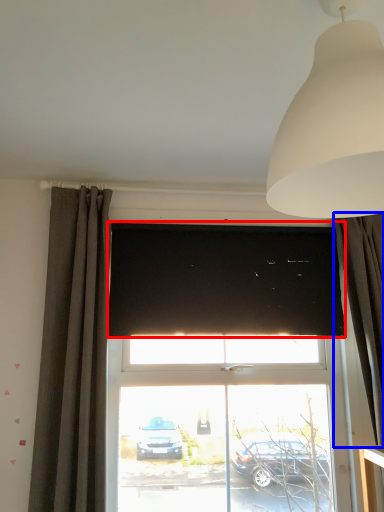
Question: Among these objects, which one is farthest to the camera, window screen (highlighted by a red box) or curtain (highlighted by a blue box)?

Choices:
 (A) window screen
 (B) curtain

Answer: (A)